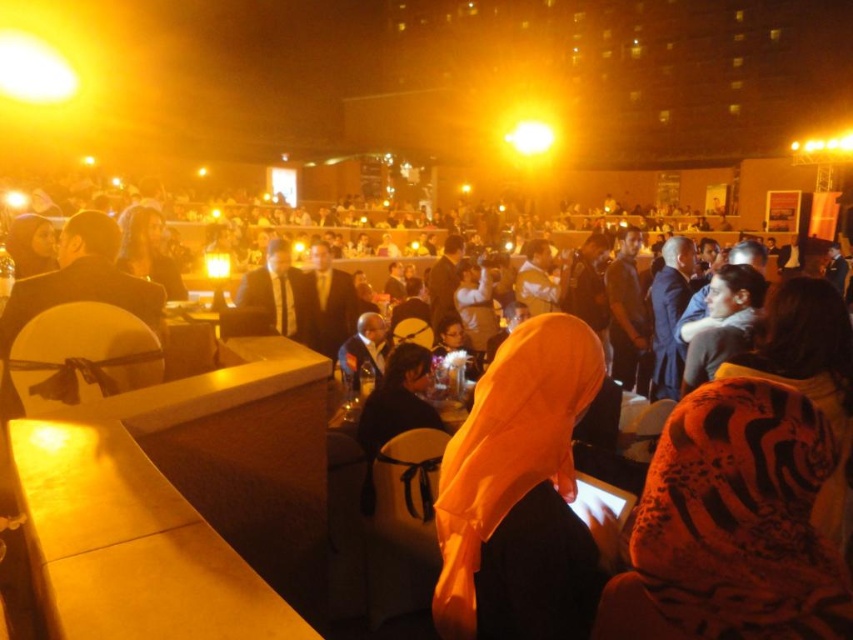
You are a photographer at this event and need to position a camera stand between the wooden table at lower left and the matte black suit at center. The stand requires a minimum of 1 meter of space. Can you fit it there based on their widths?

The wooden table at lower left is wider than the matte black suit at center. However, the exact widths are not provided, so it is uncertain if the combined space between them meets the 1 meter requirement. Additional measurements would be needed to confirm.